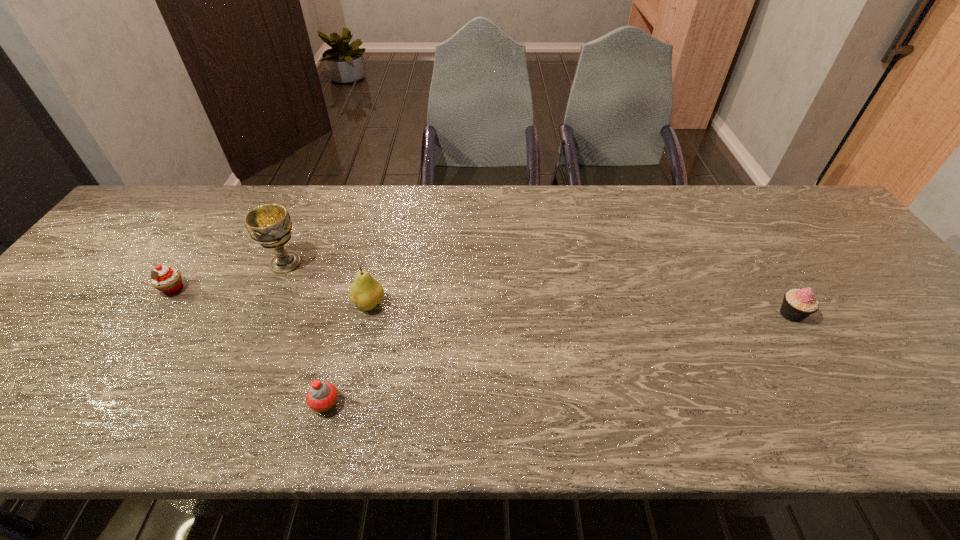
Locate which object ranks in proximity to the second object from left to right. Please provide its 2D coordinates. Your answer should be formatted as a tuple, i.e. [(x, y)], where the tuple contains the x and y coordinates of a point satisfying the conditions above.

[(366, 292)]

Locate which object is the third closest to the leftmost cupcake. Please provide its 2D coordinates. Your answer should be formatted as a tuple, i.e. [(x, y)], where the tuple contains the x and y coordinates of a point satisfying the conditions above.

[(322, 396)]

Select which cupcake appears as the closest to the rightmost cupcake. Please provide its 2D coordinates. Your answer should be formatted as a tuple, i.e. [(x, y)], where the tuple contains the x and y coordinates of a point satisfying the conditions above.

[(322, 396)]

Select which cupcake is the second closest to the fourth shortest object. Please provide its 2D coordinates. Your answer should be formatted as a tuple, i.e. [(x, y)], where the tuple contains the x and y coordinates of a point satisfying the conditions above.

[(168, 280)]

You are a GUI agent. You are given a task and a screenshot of the screen. Output one action in this format:
    pyautogui.click(x=<x>, y=<y>)
    Task: Click on the vacant area in the image that satisfies the following two spatial constraints: 1. on the front side of the rightmost cupcake; 2. on the right side of the pear
    Image resolution: width=960 pixels, height=540 pixels.
    Given the screenshot: What is the action you would take?
    pyautogui.click(x=367, y=314)

The width and height of the screenshot is (960, 540). I want to click on vacant region that satisfies the following two spatial constraints: 1. on the front side of the pear; 2. on the right side of the rightmost object, so click(x=367, y=314).

Locate an element on the screen. free space that satisfies the following two spatial constraints: 1. on the front side of the second cupcake from right to left; 2. on the right side of the chalice is located at coordinates (224, 404).

Where is `free space in the image that satisfies the following two spatial constraints: 1. on the front side of the leftmost cupcake; 2. on the left side of the second cupcake from right to left`? This screenshot has width=960, height=540. free space in the image that satisfies the following two spatial constraints: 1. on the front side of the leftmost cupcake; 2. on the left side of the second cupcake from right to left is located at coordinates (99, 404).